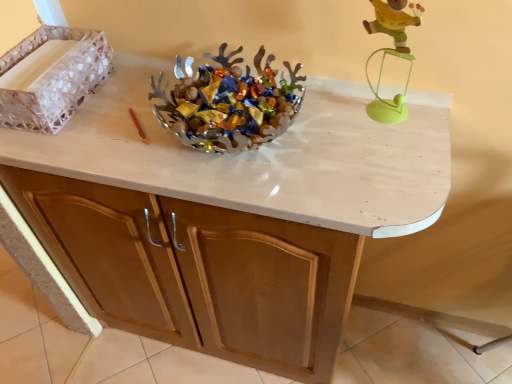
Find the location of `free space between white textured tray at left and metallic silver bowl at center`. free space between white textured tray at left and metallic silver bowl at center is located at coordinates (117, 105).